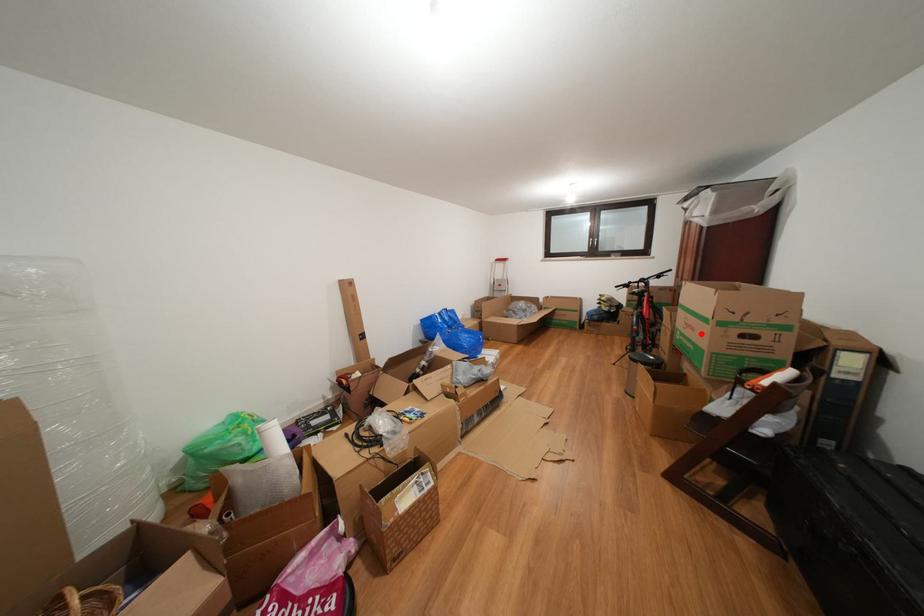
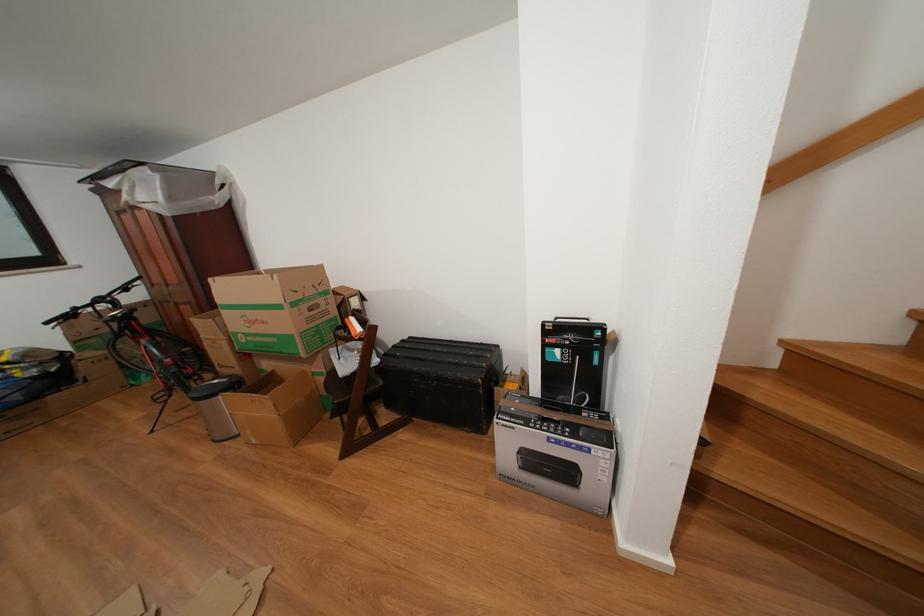
The point at the highlighted location is marked in the first image. Where is the corresponding point in the second image?

(272, 328)